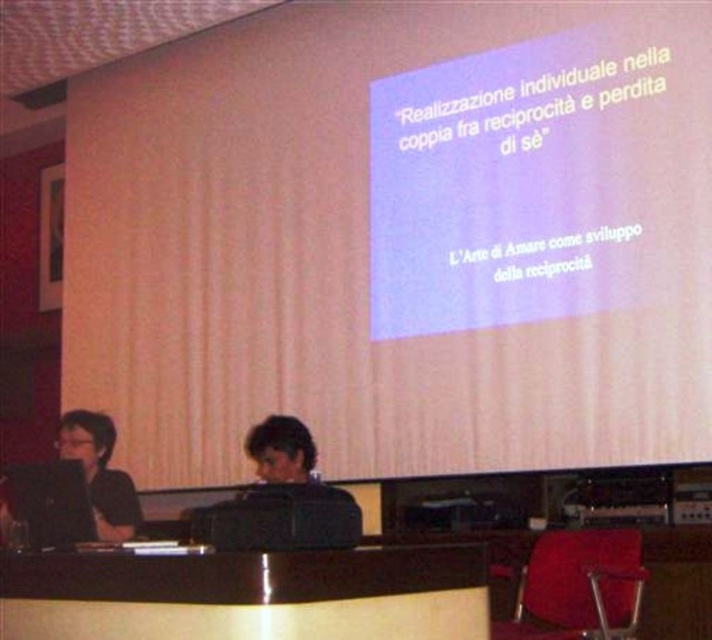
Question: Which of the following is the farthest from the observer?

Choices:
 (A) velvet red chair at lower right
 (B) black glossy table at center

Answer: (A)

Question: From the image, what is the correct spatial relationship of black glossy table at center in relation to velvet red chair at lower right?

Choices:
 (A) below
 (B) above

Answer: (B)

Question: Where is black glossy table at center located in relation to velvet red chair at lower right in the image?

Choices:
 (A) above
 (B) below

Answer: (A)

Question: Which of the following is the closest to the observer?

Choices:
 (A) velvet red chair at lower right
 (B) black glossy table at center

Answer: (B)

Question: Is black glossy table at center below velvet red chair at lower right?

Choices:
 (A) no
 (B) yes

Answer: (A)